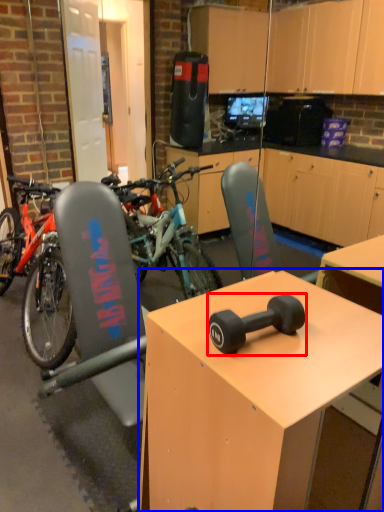
Question: Which object appears farthest to the camera in this image, dumbbell (highlighted by a red box) or desk (highlighted by a blue box)?

Choices:
 (A) dumbbell
 (B) desk

Answer: (A)